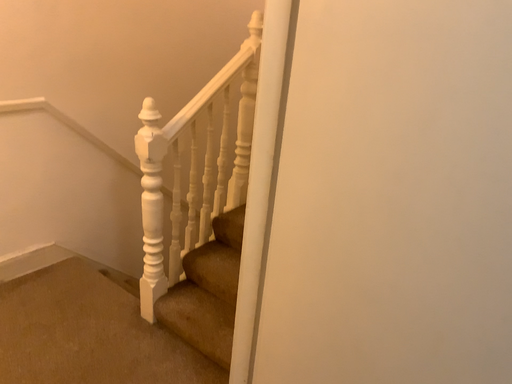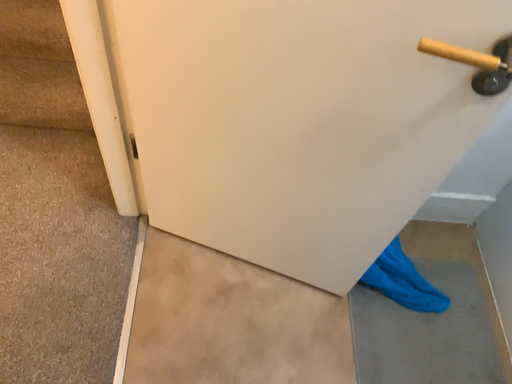
Question: Which way did the camera rotate in the video?

Choices:
 (A) rotated right
 (B) rotated left

Answer: (A)